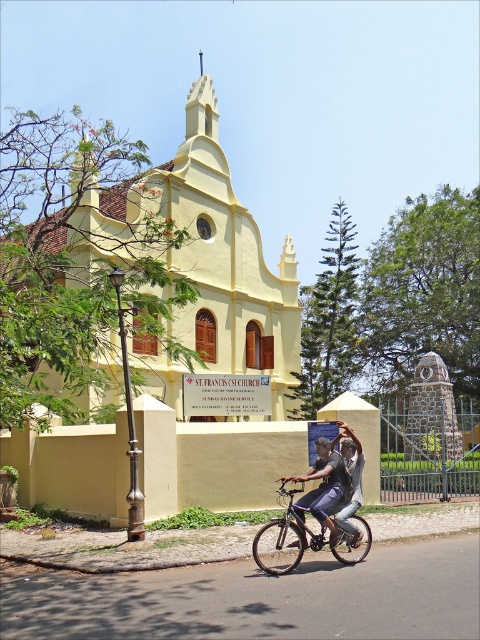
Question: Which point appears farthest from the camera in this image?

Choices:
 (A) (108, 449)
 (B) (331, 484)
 (C) (359, 451)
 (D) (361, 548)

Answer: (A)

Question: Is denim shorts at center positioned behind denim pants at center?

Choices:
 (A) yes
 (B) no

Answer: (B)

Question: Is yellow matte church at center thinner than denim shorts at center?

Choices:
 (A) yes
 (B) no

Answer: (B)

Question: In this image, where is yellow matte church at center located relative to denim pants at center?

Choices:
 (A) below
 (B) above

Answer: (B)

Question: Estimate the real-world distances between objects in this image. Which object is farther from the denim shorts at center?

Choices:
 (A) yellow matte church at center
 (B) denim pants at center

Answer: (A)

Question: Among these objects, which one is nearest to the camera?

Choices:
 (A) denim pants at center
 (B) silver metallic bicycle at center
 (C) denim shorts at center
 (D) yellow matte church at center

Answer: (B)